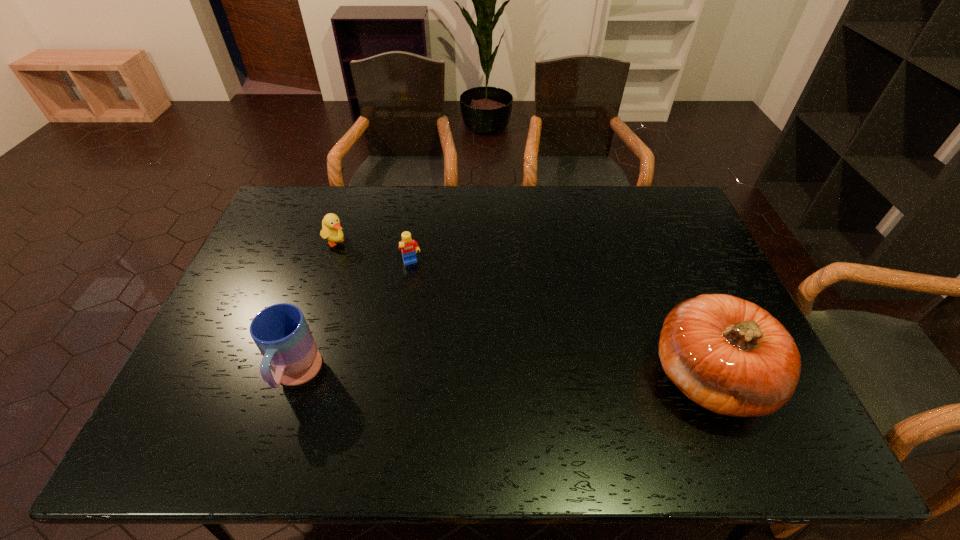
You are a GUI agent. You are given a task and a screenshot of the screen. Output one action in this format:
    pyautogui.click(x=<x>, y=<y>)
    Task: Click on the vacant spot on the desktop that is between the mug and the rightmost object and is positioned on the face of the second object from right to left
    
    Given the screenshot: What is the action you would take?
    pyautogui.click(x=459, y=376)

Image resolution: width=960 pixels, height=540 pixels. I want to click on vacant space on the desktop that is between the second tallest object and the tallest object and is positioned on the front-facing side of the farthest object, so click(509, 376).